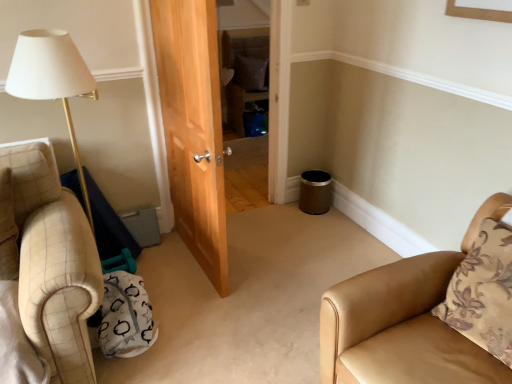
Question: From the image's perspective, is brown fabric pillow at center, the second pillow positioned from the front, above or below brown floral pillow at right, which is the 1th pillow from front to back?

Choices:
 (A) below
 (B) above

Answer: (B)

Question: Is point (252, 91) closer or farther from the camera than point (510, 332)?

Choices:
 (A) farther
 (B) closer

Answer: (A)

Question: Considering the real-world distances, which object is farthest from the brown fabric pillow at center, acting as the second pillow starting from the bottom?

Choices:
 (A) brown floral pillow at right, the first pillow in the bottom-to-top sequence
 (B) tan leather chair at lower right

Answer: (A)

Question: Considering the real-world distances, which object is closest to the brown floral pillow at right, which is the 1th pillow from front to back?

Choices:
 (A) brown fabric pillow at center, acting as the second pillow starting from the bottom
 (B) tan leather chair at lower right

Answer: (B)